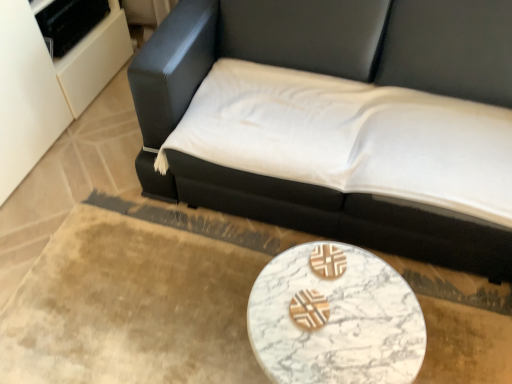
Question: Considering the positions of white marble table at lower center and black leather studio couch at upper center in the image, is white marble table at lower center wider or thinner than black leather studio couch at upper center?

Choices:
 (A) wide
 (B) thin

Answer: (B)

Question: From a real-world perspective, is white marble table at lower center above or below black leather studio couch at upper center?

Choices:
 (A) below
 (B) above

Answer: (A)

Question: Is white marble table at lower center spatially inside black leather studio couch at upper center, or outside of it?

Choices:
 (A) inside
 (B) outside

Answer: (B)

Question: Looking at their shapes, would you say black leather studio couch at upper center is wider or thinner than white marble table at lower center?

Choices:
 (A) wide
 (B) thin

Answer: (A)

Question: From a real-world perspective, is black leather studio couch at upper center physically located above or below white marble table at lower center?

Choices:
 (A) below
 (B) above

Answer: (B)

Question: Is black leather studio couch at upper center bigger or smaller than white marble table at lower center?

Choices:
 (A) small
 (B) big

Answer: (B)

Question: Is black leather studio couch at upper center to the left or to the right of white marble table at lower center in the image?

Choices:
 (A) right
 (B) left

Answer: (A)